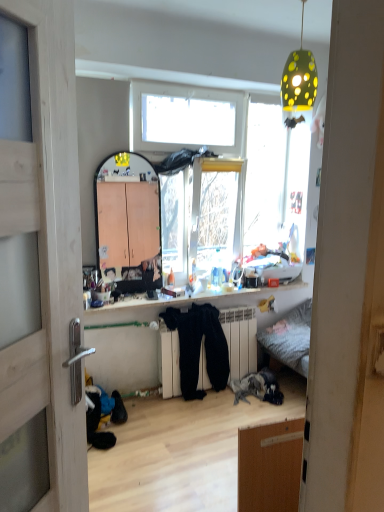
Question: Is green dotted lampshade at upper center at the left side of wooden door at left?

Choices:
 (A) yes
 (B) no

Answer: (B)

Question: From the image's perspective, does green dotted lampshade at upper center appear higher than wooden door at left?

Choices:
 (A) no
 (B) yes

Answer: (B)

Question: Could you tell me if green dotted lampshade at upper center is turned towards wooden door at left?

Choices:
 (A) no
 (B) yes

Answer: (A)

Question: Is the position of green dotted lampshade at upper center more distant than that of wooden door at left?

Choices:
 (A) no
 (B) yes

Answer: (B)

Question: Considering the relative sizes of green dotted lampshade at upper center and wooden door at left in the image provided, is green dotted lampshade at upper center wider than wooden door at left?

Choices:
 (A) no
 (B) yes

Answer: (B)

Question: From a real-world perspective, is green dotted lampshade at upper center physically below wooden door at left?

Choices:
 (A) yes
 (B) no

Answer: (B)

Question: Is white matte radiator at center thinner than wooden door at left?

Choices:
 (A) no
 (B) yes

Answer: (A)

Question: From the image's perspective, does white matte radiator at center appear lower than wooden door at left?

Choices:
 (A) no
 (B) yes

Answer: (B)

Question: From a real-world perspective, is white matte radiator at center under wooden door at left?

Choices:
 (A) no
 (B) yes

Answer: (B)

Question: Does white matte radiator at center have a larger size compared to wooden door at left?

Choices:
 (A) yes
 (B) no

Answer: (A)

Question: Is white matte radiator at center taller than wooden door at left?

Choices:
 (A) no
 (B) yes

Answer: (A)

Question: Is white matte radiator at center far from wooden door at left?

Choices:
 (A) no
 (B) yes

Answer: (B)

Question: Considering the relative positions of white matte radiator at center and shiny plastic shelf at center in the image provided, is white matte radiator at center in front of shiny plastic shelf at center?

Choices:
 (A) no
 (B) yes

Answer: (A)